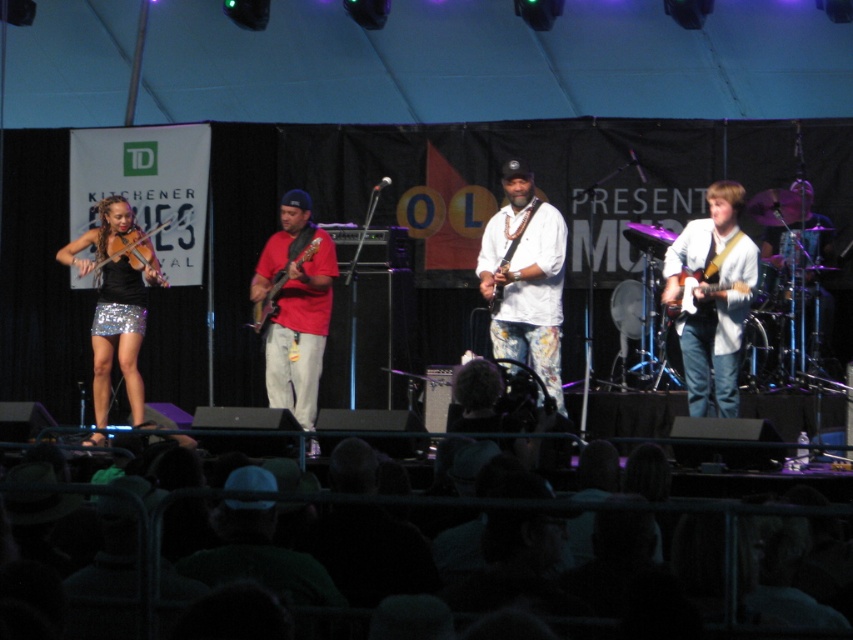
You are a photographer standing at the front of the audience, aiming to capture a photo of the performer wearing the white floral pants at center. Based on their position on stage, can you determine if they are positioned to the left or right of the center of the stage?

The white floral pants at center is located at point (525, 276), which places them slightly to the right of the stage center. However, since the coordinate system might vary, the description states they are at the center, so the answer should reflect that they are at the center as per the given information.

You are a photographer trying to capture the stage setup. You notice two points marked on the stage at coordinates point [666,312] and point [534,212]. Which point is closer to your camera position?

Point [666,312] is closer to the camera than point [534,212].